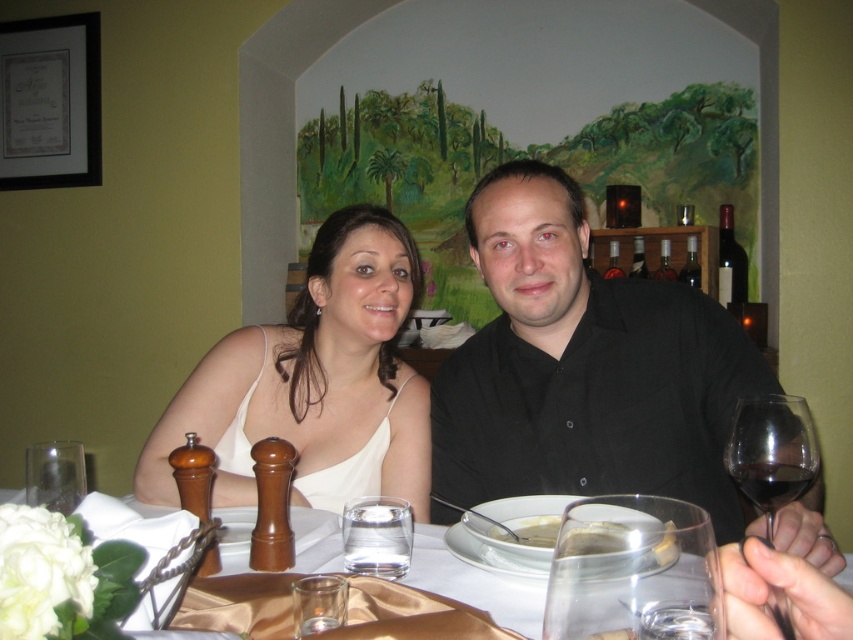
You are a waiter at a restaurant and you need to place a new wine glass on the table. The existing transparent glass wine glass at right is located at point (770, 452). Where should you place the new wine glass so that it is exactly 0.1 units to the left of the existing one?

Place the new wine glass at point 0.608, 0.905 to be exactly 0.1 units to the left of the existing transparent glass wine glass at right located at (770, 452).

What is the exact location of the translucent glass water at center in the image?

The translucent glass water at center is located at point coordinates of (474,582).